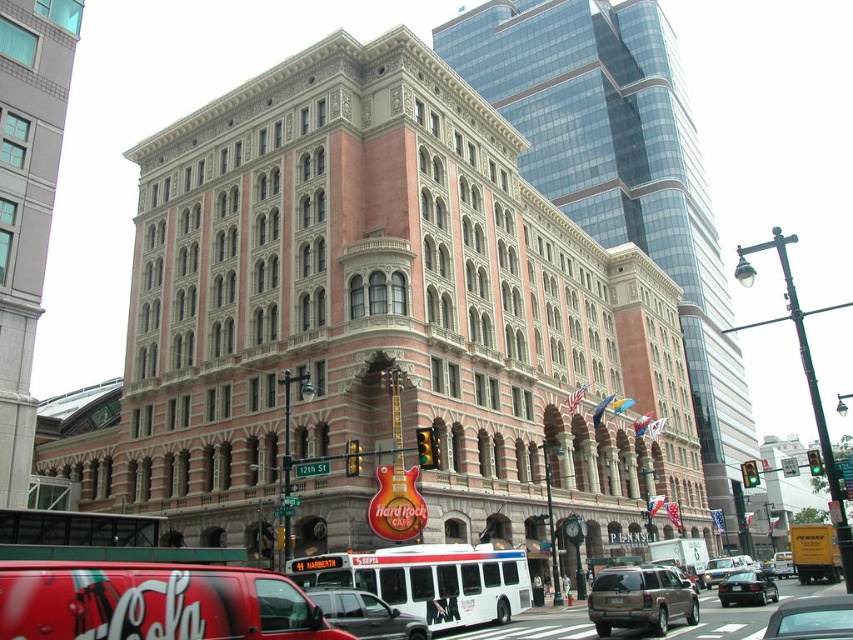
Is white matte bus at center thinner than shiny black sedan at center?

Incorrect, white matte bus at center's width is not less than shiny black sedan at center's.

Can you confirm if white matte bus at center is taller than shiny black sedan at center?

Incorrect, white matte bus at center's height is not larger of shiny black sedan at center's.

Who is more distant from viewer, (410, 547) or (737, 580)?

The point (737, 580) is behind.

Identify the location of white matte bus at center. (428, 580).

Image resolution: width=853 pixels, height=640 pixels. Describe the element at coordinates (640, 600) in the screenshot. I see `metallic brown suv at center` at that location.

Is metallic brown suv at center above metallic silver suv at center?

Actually, metallic brown suv at center is below metallic silver suv at center.

Is point (595, 580) farther from viewer compared to point (341, 593)?

Yes, point (595, 580) is farther from viewer.

You are a GUI agent. You are given a task and a screenshot of the screen. Output one action in this format:
    pyautogui.click(x=<x>, y=<y>)
    Task: Click on the metallic brown suv at center
    
    Given the screenshot: What is the action you would take?
    pyautogui.click(x=640, y=600)

Locate an element on the screen. This screenshot has height=640, width=853. metallic silver suv at center is located at coordinates (364, 614).

From the picture: Is metallic silver suv at center below shiny black sedan at center?

No.

Find the location of a particular element. metallic silver suv at center is located at coordinates (364, 614).